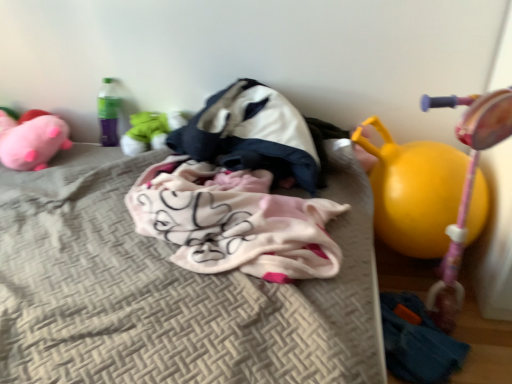
Question: Should I look upward or downward to see yellow rubber ball at right?

Choices:
 (A) down
 (B) up

Answer: (A)

Question: Is yellow rubber ball at right, the 3th toy when ordered from left to right, positioned far away from fluffy pink blanket at center?

Choices:
 (A) no
 (B) yes

Answer: (A)

Question: Considering the relative sizes of yellow rubber ball at right, placed as the 1th toy when sorted from right to left, and fluffy pink blanket at center in the image provided, is yellow rubber ball at right, placed as the 1th toy when sorted from right to left, taller than fluffy pink blanket at center?

Choices:
 (A) yes
 (B) no

Answer: (A)

Question: Is yellow rubber ball at right, the 3th toy when ordered from left to right, behind fluffy pink blanket at center?

Choices:
 (A) no
 (B) yes

Answer: (B)

Question: Can fluffy pink blanket at center be found inside yellow rubber ball at right, the 3th toy when ordered from left to right?

Choices:
 (A) yes
 (B) no

Answer: (B)

Question: Is yellow rubber ball at right, placed as the 1th toy when sorted from right to left, positioned with its back to fluffy pink blanket at center?

Choices:
 (A) no
 (B) yes

Answer: (A)

Question: Could you tell me if yellow rubber ball at right, placed as the 1th toy when sorted from right to left, is turned towards fluffy pink blanket at center?

Choices:
 (A) yes
 (B) no

Answer: (B)

Question: Does yellow rubber ball at right, placed as the 1th toy when sorted from right to left, appear on the right side of soft plush toy at center, the 2th toy in the right-to-left sequence?

Choices:
 (A) yes
 (B) no

Answer: (A)

Question: Considering the relative positions of yellow rubber ball at right, the 3th toy when ordered from left to right, and soft plush toy at center, the 2th toy in the right-to-left sequence, in the image provided, is yellow rubber ball at right, the 3th toy when ordered from left to right, to the left of soft plush toy at center, the 2th toy in the right-to-left sequence, from the viewer's perspective?

Choices:
 (A) no
 (B) yes

Answer: (A)

Question: From the image's perspective, is yellow rubber ball at right, placed as the 1th toy when sorted from right to left, on top of soft plush toy at center, the 2th toy in the right-to-left sequence?

Choices:
 (A) yes
 (B) no

Answer: (B)

Question: Considering the relative sizes of yellow rubber ball at right, the 3th toy when ordered from left to right, and soft plush toy at center, the 2th toy in the right-to-left sequence, in the image provided, is yellow rubber ball at right, the 3th toy when ordered from left to right, smaller than soft plush toy at center, the 2th toy in the right-to-left sequence,?

Choices:
 (A) yes
 (B) no

Answer: (B)

Question: Is yellow rubber ball at right, the 3th toy when ordered from left to right, further to camera compared to soft plush toy at center, the 2th toy in the right-to-left sequence?

Choices:
 (A) yes
 (B) no

Answer: (B)

Question: Can you confirm if yellow rubber ball at right, the 3th toy when ordered from left to right, is bigger than soft plush toy at center, the 2th toy in the right-to-left sequence?

Choices:
 (A) no
 (B) yes

Answer: (B)

Question: Considering the relative positions of soft plush toy at center, positioned as the second toy in left-to-right order, and fluffy pink blanket at center in the image provided, is soft plush toy at center, positioned as the second toy in left-to-right order, to the left of fluffy pink blanket at center from the viewer's perspective?

Choices:
 (A) no
 (B) yes

Answer: (B)